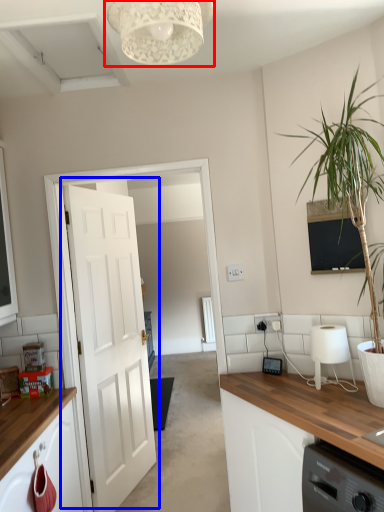
Question: Which object appears farthest to the camera in this image, light fixture (highlighted by a red box) or door (highlighted by a blue box)?

Choices:
 (A) light fixture
 (B) door

Answer: (B)